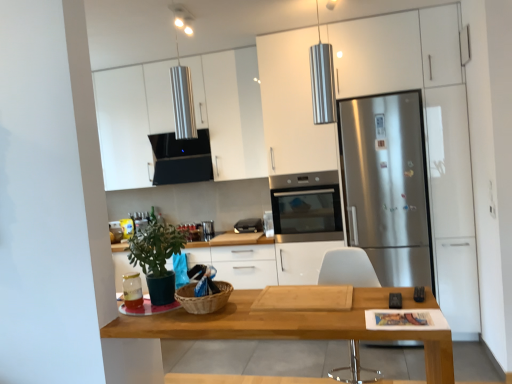
Question: Is wooden table at center in front of or behind black matte exhaust hood at upper center in the image?

Choices:
 (A) front
 (B) behind

Answer: (A)

Question: Considering the positions of wooden table at center and black matte exhaust hood at upper center in the image, is wooden table at center taller or shorter than black matte exhaust hood at upper center?

Choices:
 (A) tall
 (B) short

Answer: (A)

Question: Estimate the real-world distances between objects in this image. Which object is farther from the stainless steel oven at center?

Choices:
 (A) black plastic remote control at lower center, which is counted as the third appliance, starting from the left
 (B) green matte plant at lower left
 (C) white glossy cabinet at upper center
 (D) matte glass jar at lower left, the first appliance positioned from the left
 (E) black plastic toaster at center, arranged as the 1th appliance when viewed from the top

Answer: (D)

Question: Which is nearer to the white plastic chair at center?

Choices:
 (A) white glossy cabinet at upper center
 (B) stainless steel oven at center
 (C) black plastic remote control at lower center, which appears as the 1th appliance when viewed from the right
 (D) green matte plant at lower left
 (E) matte glass jar at lower left, acting as the 3th appliance starting from the right

Answer: (C)